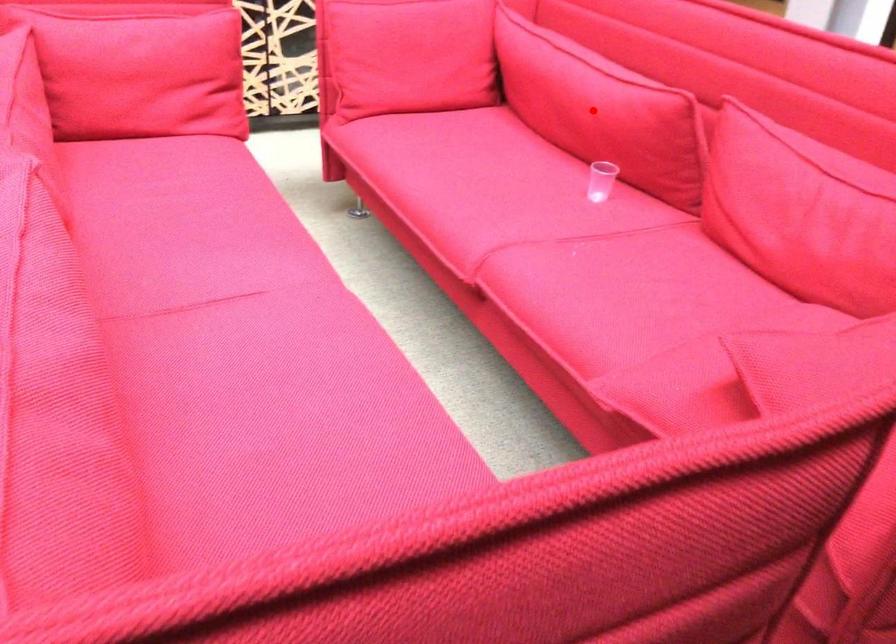
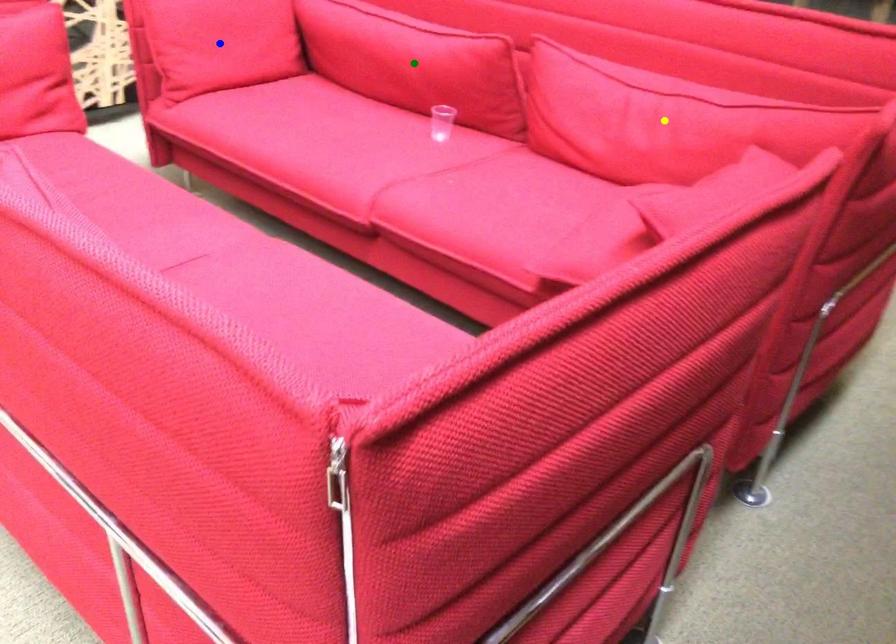
Question: I am providing you with two images of the same scene from different viewpoints. A red point is marked on the first image. You are given multiple points on the second image. Which point in image 2 is actually the same real-world point as the red point in image 1?

Choices:
 (A) yellow point
 (B) green point
 (C) blue point

Answer: (B)